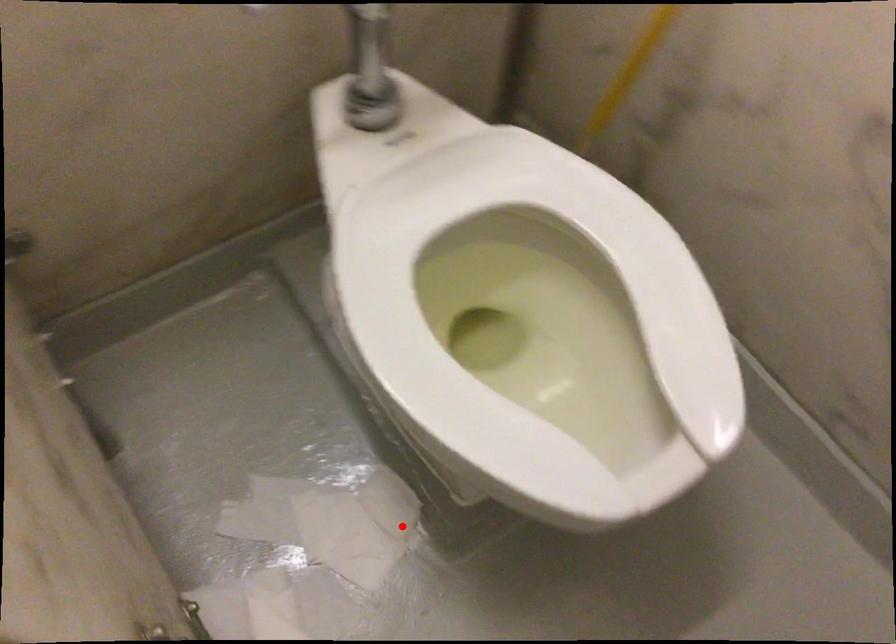
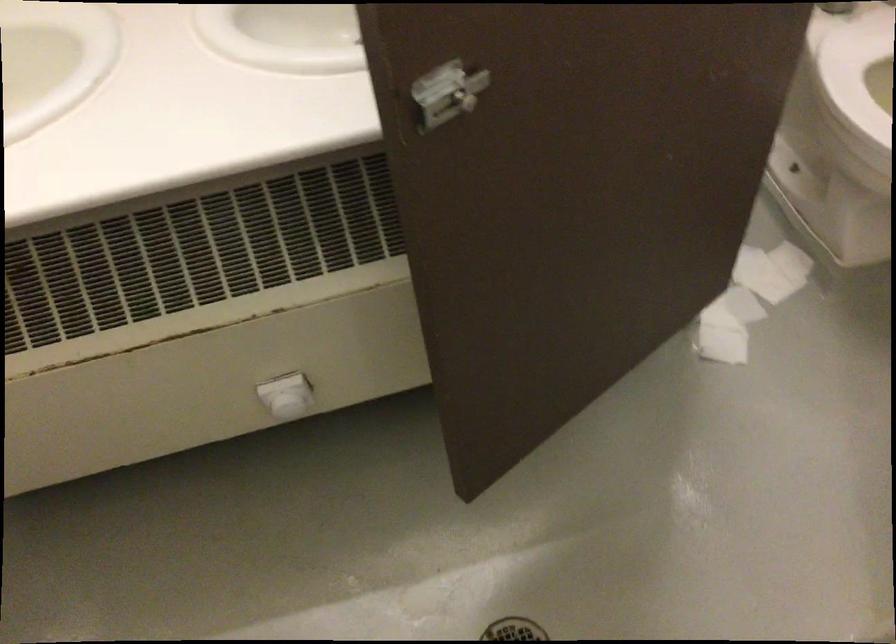
In the second image, find the point that corresponds to the highlighted location in the first image.

(790, 261)